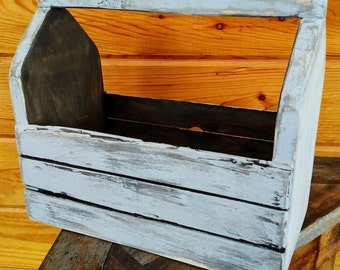
Where is `basket`? Image resolution: width=340 pixels, height=270 pixels. basket is located at coordinates (238, 160).